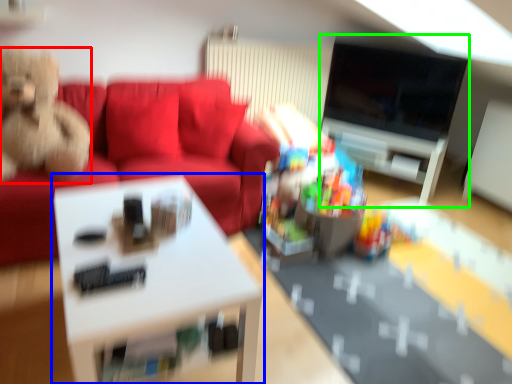
Question: Considering the real-world distances, which object is farthest from toy (highlighted by a red box)? table (highlighted by a blue box) or entertainment center (highlighted by a green box)?

Choices:
 (A) table
 (B) entertainment center

Answer: (B)